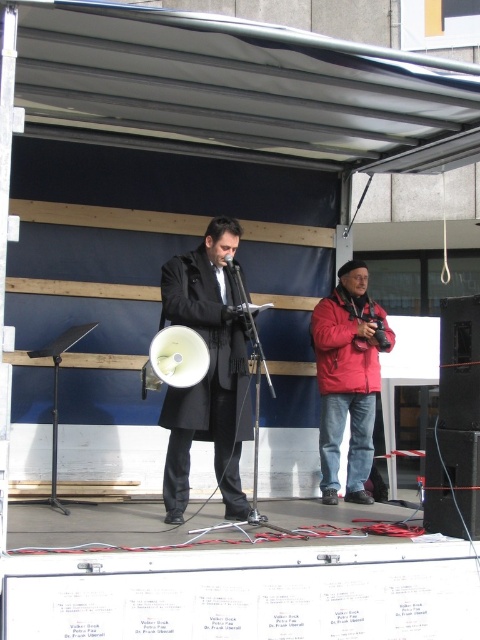
Question: Which of the following is the closest to the observer?

Choices:
 (A) (448, 381)
 (B) (231, 272)
 (C) (228, 248)
 (D) (344, 346)

Answer: (A)

Question: Does black matte speaker at lower right have a lesser width compared to matte black megaphone at center?

Choices:
 (A) no
 (B) yes

Answer: (A)

Question: Which of these objects is positioned farthest from the matte black megaphone at center?

Choices:
 (A) matte black coat at center
 (B) red matte jacket at right
 (C) black matte speaker at lower right

Answer: (C)

Question: Is matte black coat at center thinner than red matte jacket at right?

Choices:
 (A) no
 (B) yes

Answer: (B)

Question: Which object is farther from the camera taking this photo?

Choices:
 (A) matte black coat at center
 (B) black plastic speaker at center
 (C) red matte jacket at right

Answer: (C)

Question: Does red matte jacket at right have a larger size compared to black plastic speaker at center?

Choices:
 (A) yes
 (B) no

Answer: (A)